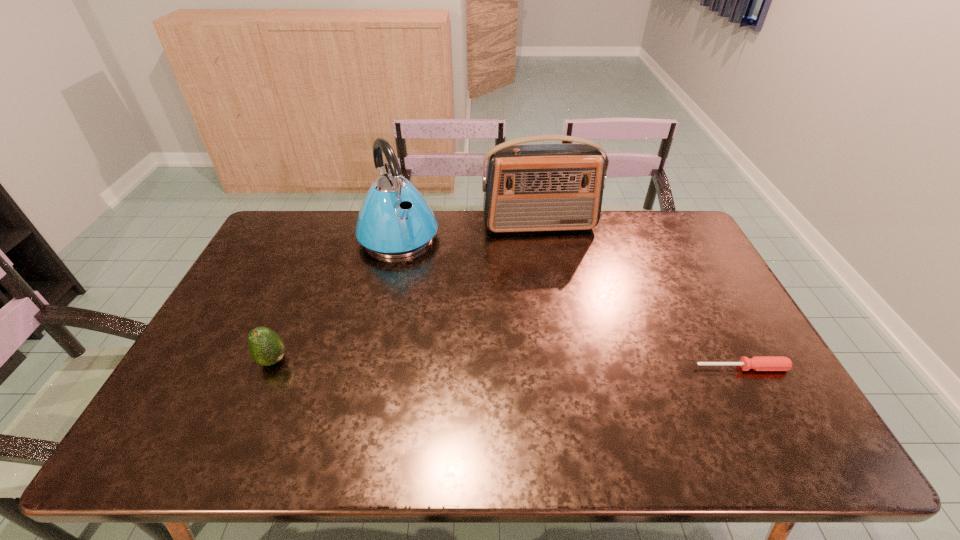
Locate an element on the screen. Image resolution: width=960 pixels, height=540 pixels. free space on the desktop that is between the leftmost object and the rightmost object and is positioned on the front-facing side of the radio receiver is located at coordinates (576, 365).

I want to click on free space on the desktop that is between the leftmost object and the rightmost object and is positioned at the spout of the third object from right to left, so click(x=489, y=364).